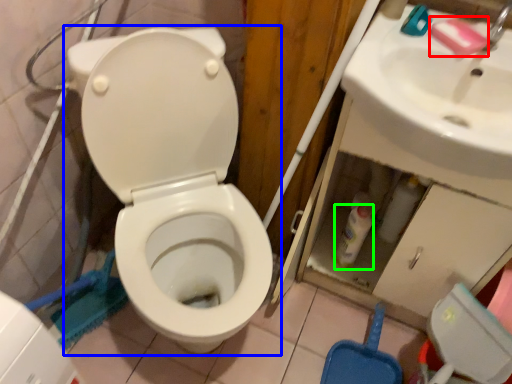
Question: Considering the real-world distances, which object is closest to soap (highlighted by a red box)? toilet (highlighted by a blue box) or bottle (highlighted by a green box).

Choices:
 (A) toilet
 (B) bottle

Answer: (B)